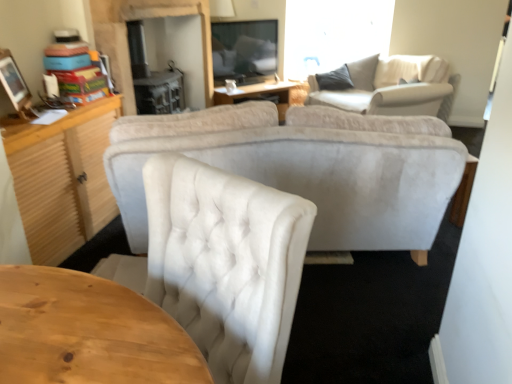
Question: From a real-world perspective, is white tufted fabric chair at center under wooden table at center?

Choices:
 (A) no
 (B) yes

Answer: (A)

Question: Can you confirm if white tufted fabric chair at center is thinner than wooden table at center?

Choices:
 (A) no
 (B) yes

Answer: (A)

Question: Is white tufted fabric chair at center not within wooden table at center?

Choices:
 (A) no
 (B) yes

Answer: (B)

Question: Is white tufted fabric chair at center at the left side of wooden table at center?

Choices:
 (A) yes
 (B) no

Answer: (A)

Question: From the image's perspective, is white tufted fabric chair at center located beneath wooden table at center?

Choices:
 (A) no
 (B) yes

Answer: (B)

Question: From a real-world perspective, is white tufted fabric chair at center located higher than wooden table at center?

Choices:
 (A) yes
 (B) no

Answer: (A)

Question: From the image's perspective, is white tufted fabric chair at center on top of light gray fabric couch at upper right?

Choices:
 (A) yes
 (B) no

Answer: (B)

Question: Is white tufted fabric chair at center smaller than light gray fabric couch at upper right?

Choices:
 (A) yes
 (B) no

Answer: (A)

Question: Is white tufted fabric chair at center thinner than light gray fabric couch at upper right?

Choices:
 (A) no
 (B) yes

Answer: (B)

Question: From the image's perspective, does white tufted fabric chair at center appear lower than light gray fabric couch at upper right?

Choices:
 (A) yes
 (B) no

Answer: (A)

Question: Considering the relative sizes of white tufted fabric chair at center and light gray fabric couch at upper right in the image provided, is white tufted fabric chair at center wider than light gray fabric couch at upper right?

Choices:
 (A) yes
 (B) no

Answer: (B)

Question: Considering the relative sizes of white tufted fabric chair at center and light gray fabric couch at upper right in the image provided, is white tufted fabric chair at center shorter than light gray fabric couch at upper right?

Choices:
 (A) yes
 (B) no

Answer: (B)

Question: From the image's perspective, is light gray fabric couch at upper right on top of wooden table at center?

Choices:
 (A) no
 (B) yes

Answer: (B)